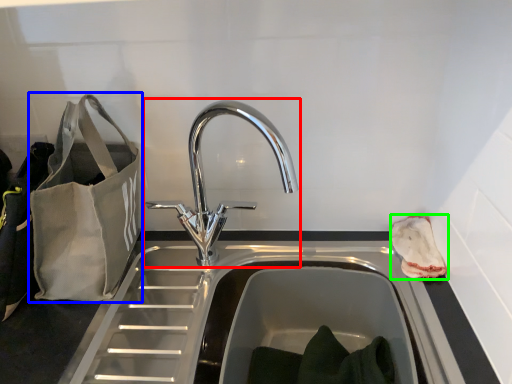
Question: Which object is positioned closest to tap (highlighted by a red box)? Select from bag (highlighted by a blue box) and pouch (highlighted by a green box).

Choices:
 (A) bag
 (B) pouch

Answer: (A)